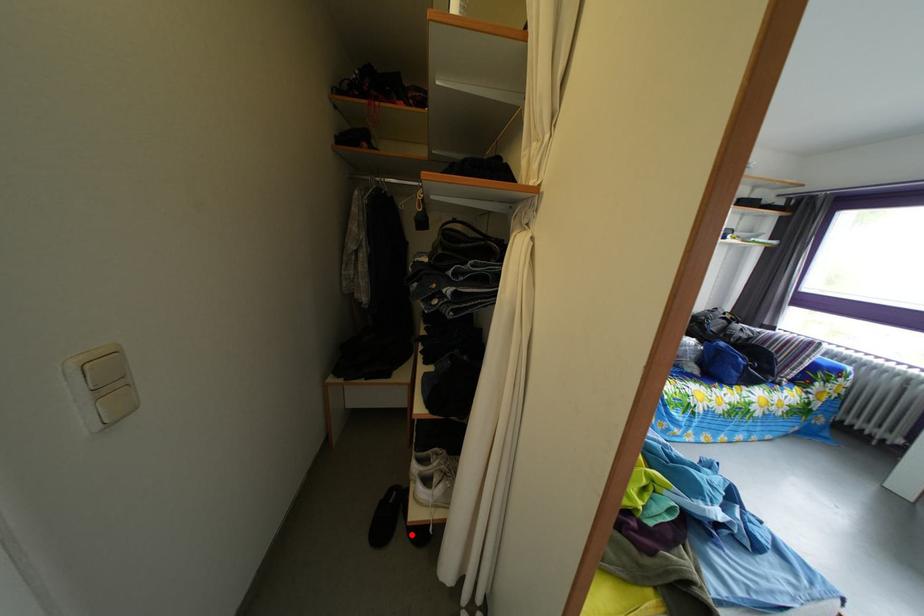
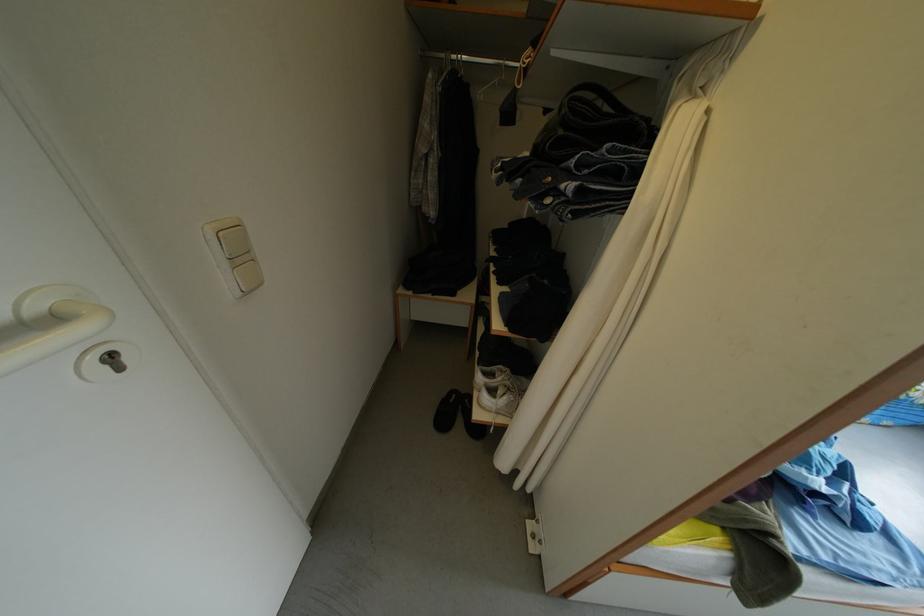
Locate, in the second image, the point that corresponds to the highlighted location in the first image.

(470, 430)